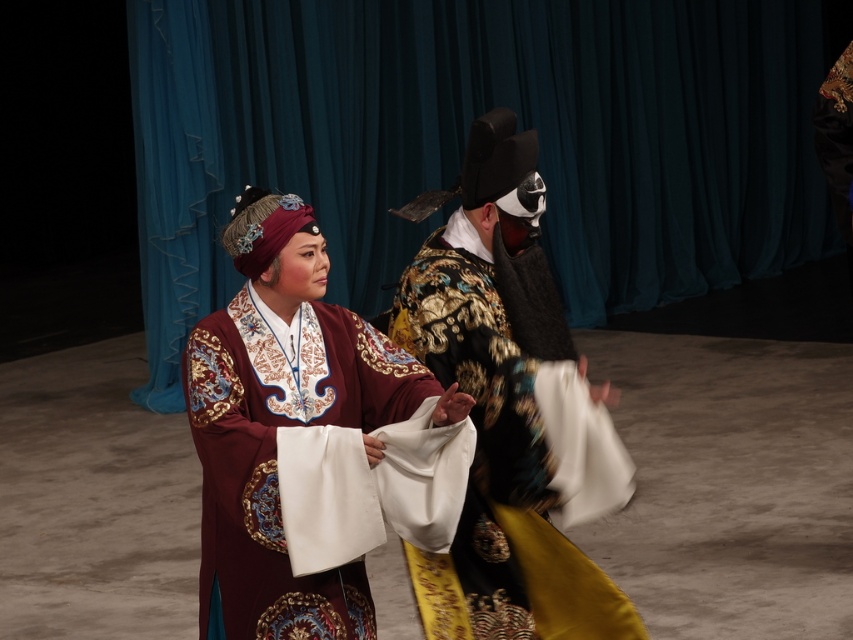
You are an assistant helping to prepare for a stage performance. You need to ensure that the gold brocade robe at center and the velvet maroon robe at center are displayed properly. Based on their sizes, which robe should be placed on the higher rack to avoid blocking the view of the smaller one?

The gold brocade robe at center is taller than the velvet maroon robe at center, so it should be placed on the higher rack to ensure the shorter velvet maroon robe at center remains visible.

You are a stagehand preparing to move the gold brocade robe at center and the velvet maroon robe at center offstage. Based on their sizes, which robe requires more space to store?

The gold brocade robe at center might require more space to store since it is wider than the velvet maroon robe at center according to the description.